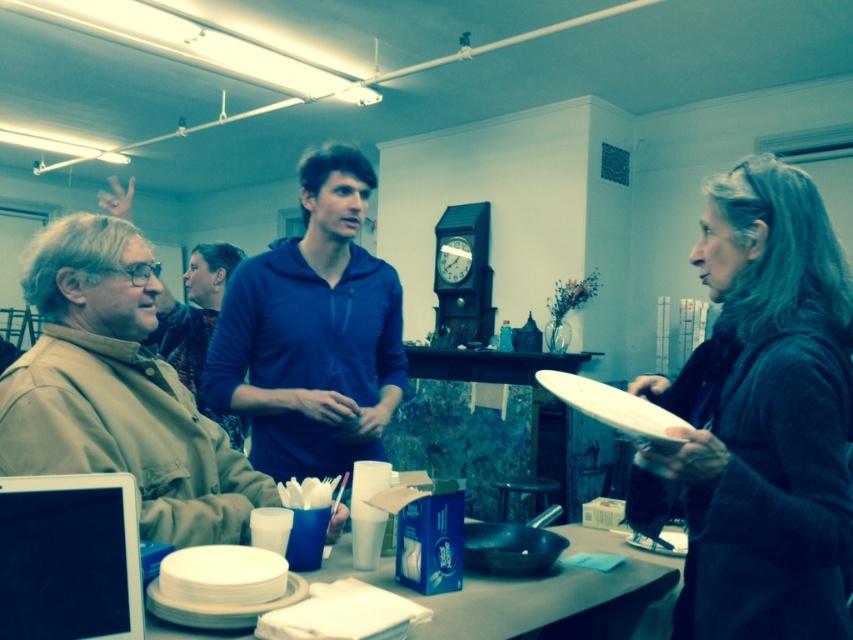
You are organizing a small event and need to place the khaki fabric jacket at left and the white paper plates at center on a shelf. If the shelf can only hold items that are not smaller than 30 cm in width, will both items fit?

The khaki fabric jacket at left has a smaller size compared to white paper plates at center. Since the jacket is smaller than the plates, but the required minimum width is 30 cm, we need to know the exact size of the plates. However, the description only states the jacket is smaller, not their actual dimensions. Therefore, it is unclear if either item meets the 30 cm requirement without additional information.

From the picture: You are organizing the items on the table and need to place the khaki fabric jacket at left and the white matte plate at lower left. Based on their current positions, which item is located higher up?

The khaki fabric jacket at left is above the white matte plate at lower left, so it is located higher up.

You are standing in the room and want to pick up the khaki fabric jacket at left. Based on its position, can you estimate where you should look to find it?

The khaki fabric jacket at left is located at point coordinates (117, 390), so you should look towards the lower left area of the room to find it.